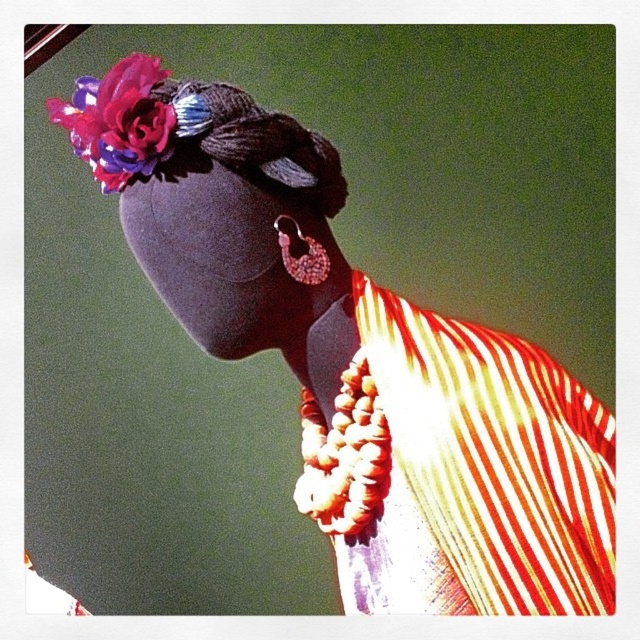
Who is positioned more to the right, silky satin flower at upper left or pearl-like beaded earring at center?

pearl-like beaded earring at center is more to the right.

Can you confirm if silky satin flower at upper left is positioned to the left of pearl-like beaded earring at center?

Correct, you'll find silky satin flower at upper left to the left of pearl-like beaded earring at center.

The image size is (640, 640). I want to click on silky satin flower at upper left, so click(120, 122).

Locate an element on the screen. This screenshot has height=640, width=640. silky satin flower at upper left is located at coordinates (120, 122).

Can you confirm if velvet floral headpiece at upper left is bigger than pearl-like beaded earring at center?

Indeed, velvet floral headpiece at upper left has a larger size compared to pearl-like beaded earring at center.

Describe the element at coordinates (192, 132) in the screenshot. The width and height of the screenshot is (640, 640). I see `velvet floral headpiece at upper left` at that location.

Locate an element on the screen. This screenshot has width=640, height=640. velvet floral headpiece at upper left is located at coordinates [x=192, y=132].

Is striped fabric dress at center wider than pearl-like beaded earring at center?

Yes.

Does striped fabric dress at center appear under pearl-like beaded earring at center?

Correct, striped fabric dress at center is located below pearl-like beaded earring at center.

Who is more forward, (504,573) or (296,230)?

Positioned in front is point (504,573).

Locate an element on the screen. The image size is (640, 640). striped fabric dress at center is located at coordinates (454, 467).